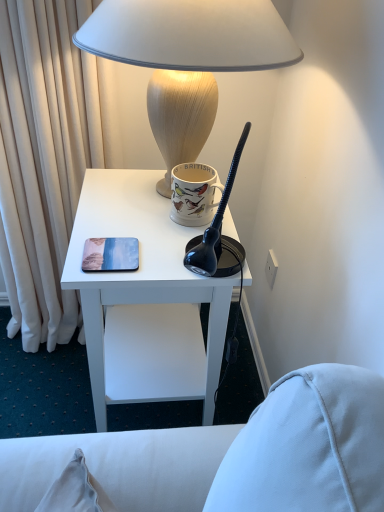
The image size is (384, 512). In order to click on vacant space underneath matte beige lamp at upper center (from a real-world perspective) in this screenshot , I will do `click(139, 194)`.